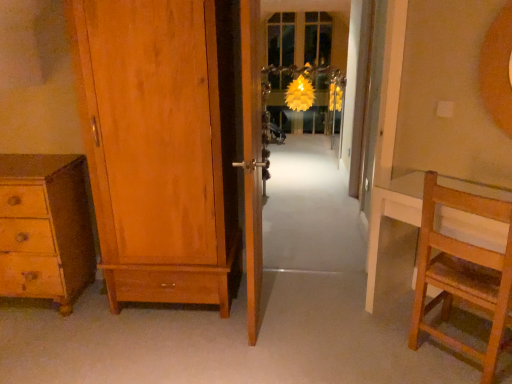
Locate an element on the screen. Image resolution: width=512 pixels, height=384 pixels. empty space that is ontop of wooden floor at center, the second path when ordered from top to bottom (from a real-world perspective) is located at coordinates (213, 334).